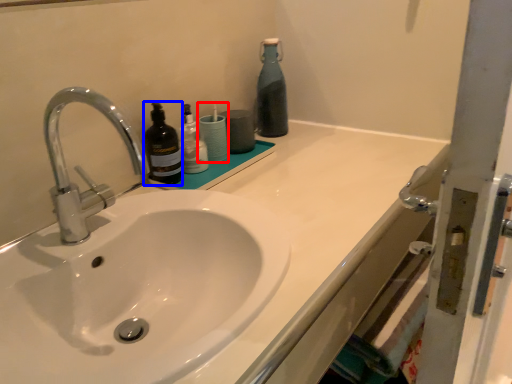
Question: Among these objects, which one is nearest to the camera, toiletry (highlighted by a red box) or bottle (highlighted by a blue box)?

Choices:
 (A) toiletry
 (B) bottle

Answer: (B)